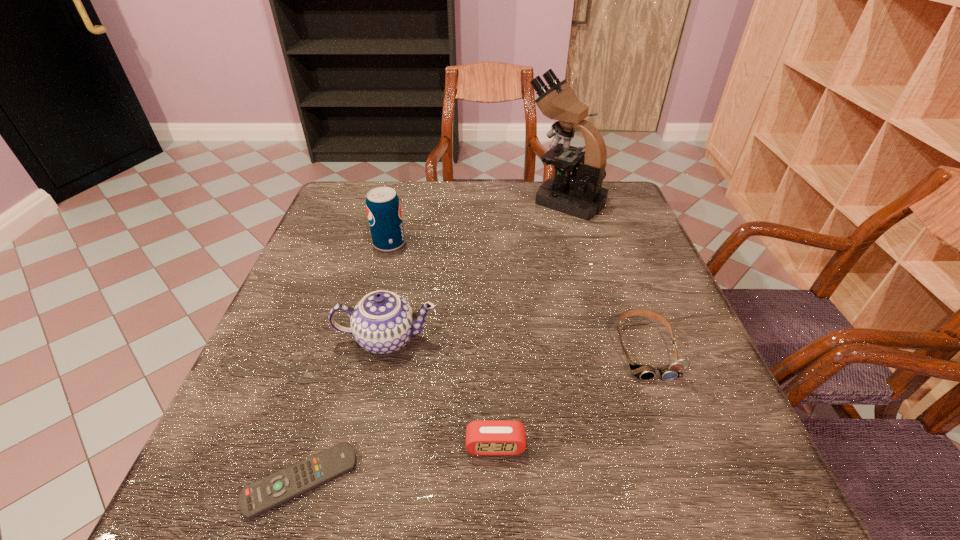
Identify the location of blank region between the alarm clock and the shortest object. (398, 463).

You are a GUI agent. You are given a task and a screenshot of the screen. Output one action in this format:
    pyautogui.click(x=<x>, y=<y>)
    Task: Click on the free space between the third tallest object and the third object from right to left
    
    Given the screenshot: What is the action you would take?
    pyautogui.click(x=442, y=393)

In order to click on free point between the chinaware and the remote control in this screenshot , I will do `click(344, 410)`.

You are a GUI agent. You are given a task and a screenshot of the screen. Output one action in this format:
    pyautogui.click(x=<x>, y=<y>)
    Task: Click on the free area in between the chinaware and the microscope
    
    Given the screenshot: What is the action you would take?
    pyautogui.click(x=476, y=269)

Identify the location of free spot between the goggles and the chinaware. (516, 344).

At what (x,y) coordinates should I click in order to perform the action: click on vacant space that is in between the farthest object and the remote control. Please return your answer as a coordinate pair (x, y). Looking at the image, I should click on (433, 340).

Where is `vacant point located between the farthest object and the third object from right to left`? vacant point located between the farthest object and the third object from right to left is located at coordinates (530, 323).

Locate which object is the closest to the microscope. Please provide its 2D coordinates. Your answer should be formatted as a tuple, i.e. [(x, y)], where the tuple contains the x and y coordinates of a point satisfying the conditions above.

[(383, 207)]

Choose which object is the fifth nearest neighbor to the goggles. Please provide its 2D coordinates. Your answer should be formatted as a tuple, i.e. [(x, y)], where the tuple contains the x and y coordinates of a point satisfying the conditions above.

[(383, 207)]

Identify the location of free space that satisfies the following two spatial constraints: 1. on the back side of the microscope; 2. on the left side of the remote control. (x=386, y=200).